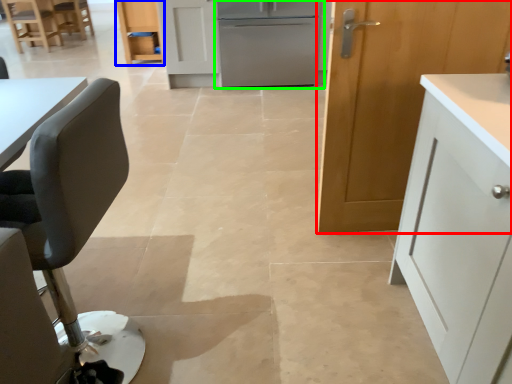
Question: Which is farther away from cabinetry (highlighted by a red box)? cabinetry (highlighted by a blue box) or refrigerator (highlighted by a green box)?

Choices:
 (A) cabinetry
 (B) refrigerator

Answer: (A)